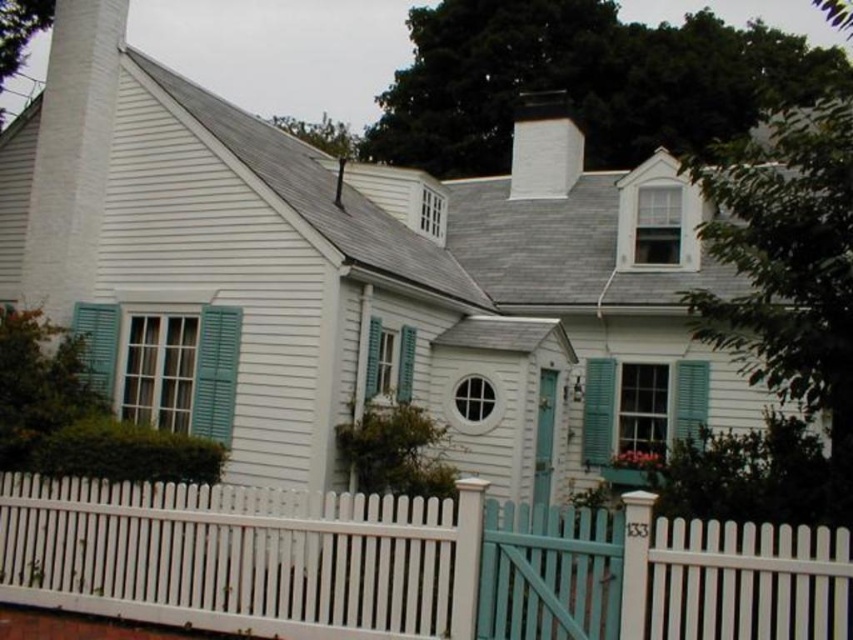
You are an interior designer assessing the symmetry of the house. Which of the two teal shutters, the teal painted wood shutter at left or the teal matte shutter at center, is taller?

The teal painted wood shutter at left is taller than the teal matte shutter at center according to the description provided.

You are standing in front of the house and want to locate the green matte shutter at center. According to the coordinates provided, where should you look?

The green matte shutter at center is located at coordinates point (598, 410).